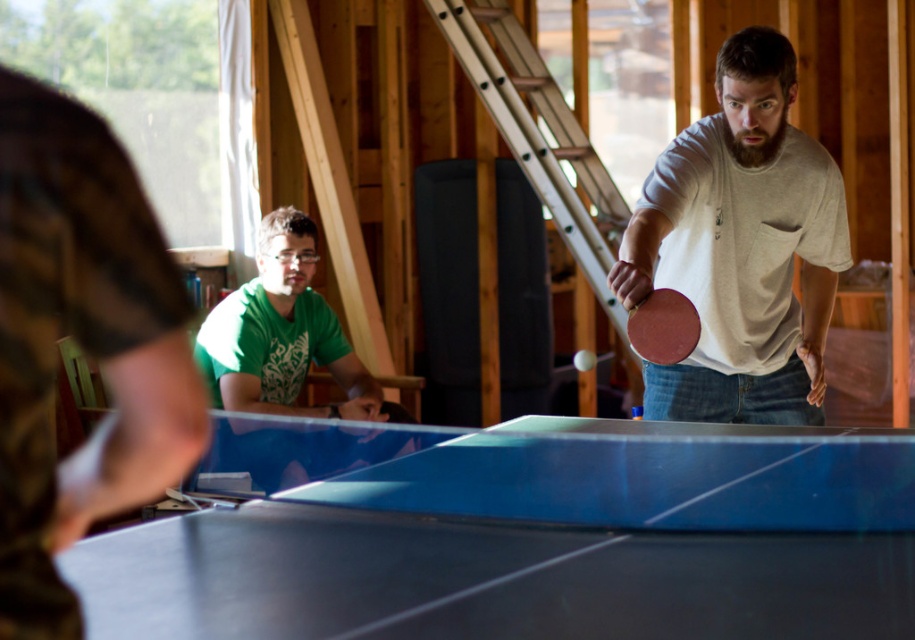
You are standing at the entrance of the room and want to locate the blue glossy ping pong table at center. According to the coordinates provided, where should you look? Please provide the coordinates in the format of a point like this example format, e.g., point 0.5,0.5.

The blue glossy ping pong table at center is located at point (x=521, y=534).

You are standing at the camera position and want to place a 6 feet long ladder against the wall behind the blue glossy ping pong table at center. Is there enough space between you and the table to safely place the ladder without touching it?

The distance between you and the blue glossy ping pong table at center is 5.61 feet, which is less than the ladder length of 6 feet. Therefore, there isn not enough space to safely place the ladder without it touching the table.

You are standing at the center of the ping pong table and want to move towards the green matte shirt at left. In which direction should you go?

Since the green matte shirt at left is located at point 0.522 on the x axis and 0.308 on the y axis, you should move towards the left side of the table to reach it.